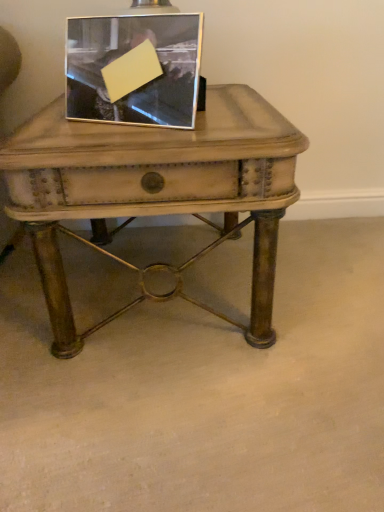
Question: From a real-world perspective, is metallic silver picture frame at upper center physically below matte wood table at center?

Choices:
 (A) no
 (B) yes

Answer: (A)

Question: Does metallic silver picture frame at upper center have a greater width compared to matte wood table at center?

Choices:
 (A) yes
 (B) no

Answer: (B)

Question: Considering the relative sizes of metallic silver picture frame at upper center and matte wood table at center in the image provided, is metallic silver picture frame at upper center bigger than matte wood table at center?

Choices:
 (A) yes
 (B) no

Answer: (B)

Question: Is metallic silver picture frame at upper center thinner than matte wood table at center?

Choices:
 (A) no
 (B) yes

Answer: (B)

Question: Does metallic silver picture frame at upper center have a greater height compared to matte wood table at center?

Choices:
 (A) yes
 (B) no

Answer: (B)

Question: From a real-world perspective, is metallic silver picture frame at upper center physically above matte wood table at center?

Choices:
 (A) yes
 (B) no

Answer: (A)

Question: From a real-world perspective, is matte wood table at center positioned under metallic silver picture frame at upper center based on gravity?

Choices:
 (A) no
 (B) yes

Answer: (B)

Question: Considering the relative sizes of matte wood table at center and metallic silver picture frame at upper center in the image provided, is matte wood table at center wider than metallic silver picture frame at upper center?

Choices:
 (A) no
 (B) yes

Answer: (B)

Question: Does matte wood table at center touch metallic silver picture frame at upper center?

Choices:
 (A) no
 (B) yes

Answer: (A)

Question: Is matte wood table at center facing away from metallic silver picture frame at upper center?

Choices:
 (A) no
 (B) yes

Answer: (A)

Question: Is matte wood table at center at the right side of metallic silver picture frame at upper center?

Choices:
 (A) no
 (B) yes

Answer: (B)

Question: Is matte wood table at center positioned in front of metallic silver picture frame at upper center?

Choices:
 (A) no
 (B) yes

Answer: (B)

Question: Looking at the image, does matte wood table at center seem bigger or smaller compared to metallic silver picture frame at upper center?

Choices:
 (A) small
 (B) big

Answer: (B)